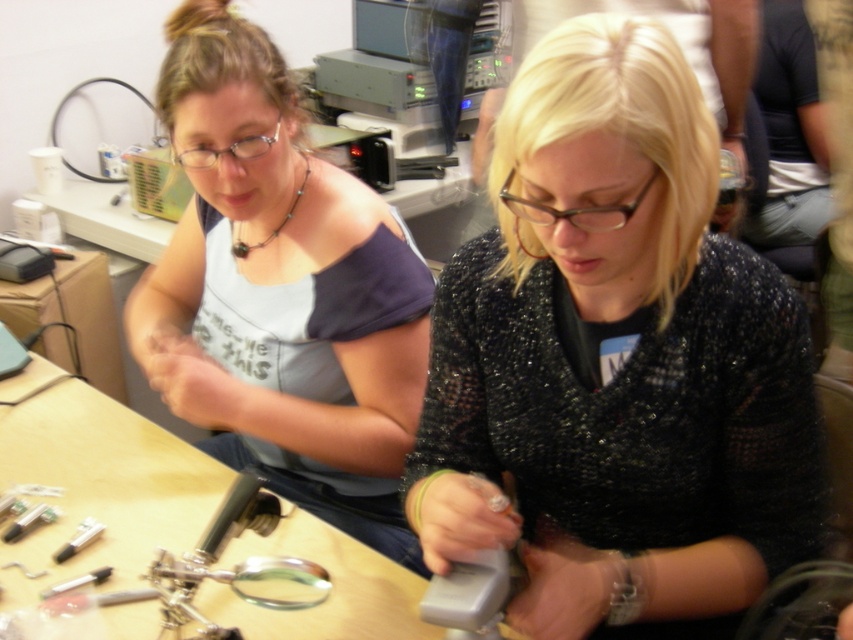
Question: Which of these objects is positioned closest to the matte blue tank top at upper left?

Choices:
 (A) black textured sweater at center
 (B) wooden table at center

Answer: (B)

Question: Considering the real-world distances, which object is closest to the wooden table at center?

Choices:
 (A) black textured sweater at center
 (B) matte blue tank top at upper left

Answer: (B)

Question: Is matte blue tank top at upper left in front of wooden table at center?

Choices:
 (A) no
 (B) yes

Answer: (A)

Question: Which point appears closest to the camera in this image?

Choices:
 (A) (149, 304)
 (B) (68, 467)
 (C) (503, 141)

Answer: (C)

Question: Can you confirm if black textured sweater at center is positioned to the right of wooden table at center?

Choices:
 (A) yes
 (B) no

Answer: (A)

Question: Is black textured sweater at center wider than matte blue tank top at upper left?

Choices:
 (A) no
 (B) yes

Answer: (A)